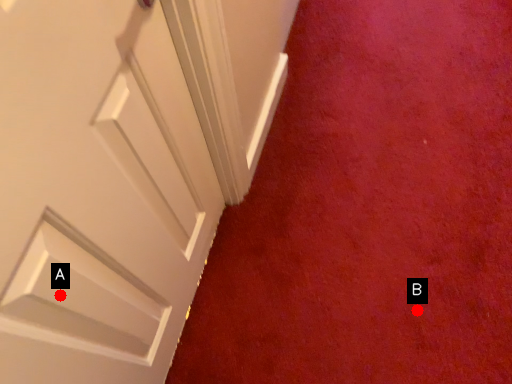
Question: Two points are circled on the image, labeled by A and B beside each circle. Which point appears closest to the camera in this image?

Choices:
 (A) A is closer
 (B) B is closer

Answer: (A)